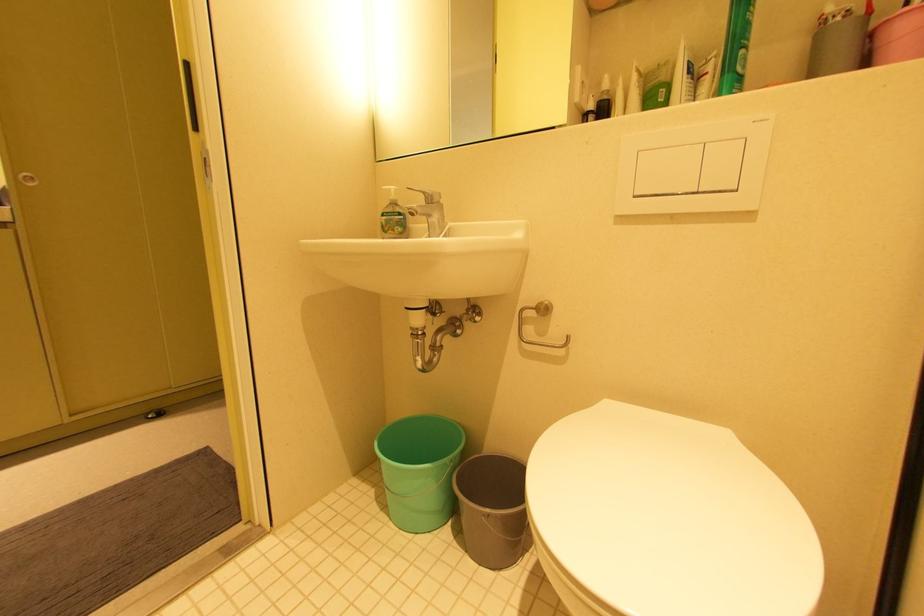
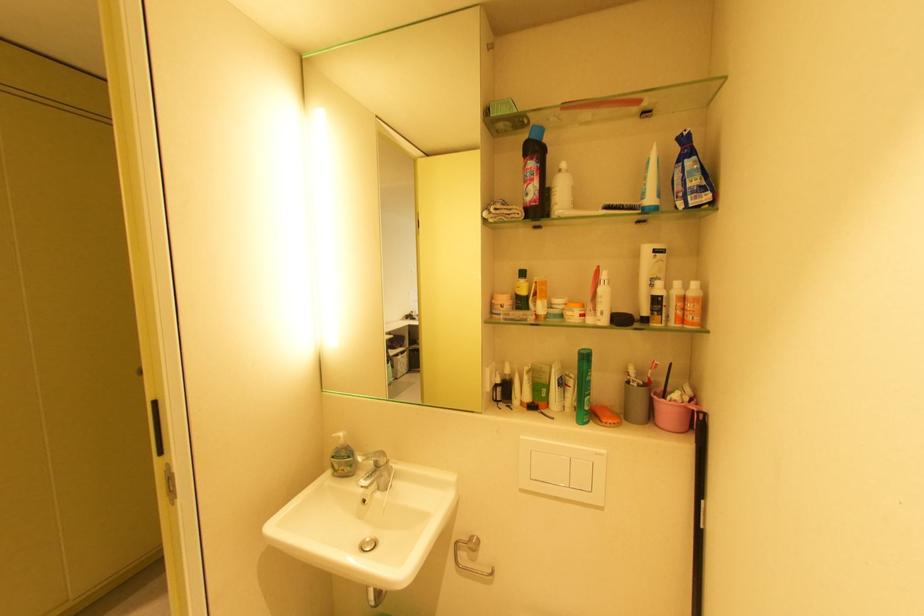
The point at (396, 190) is marked in the first image. Where is the corresponding point in the second image?

(346, 438)